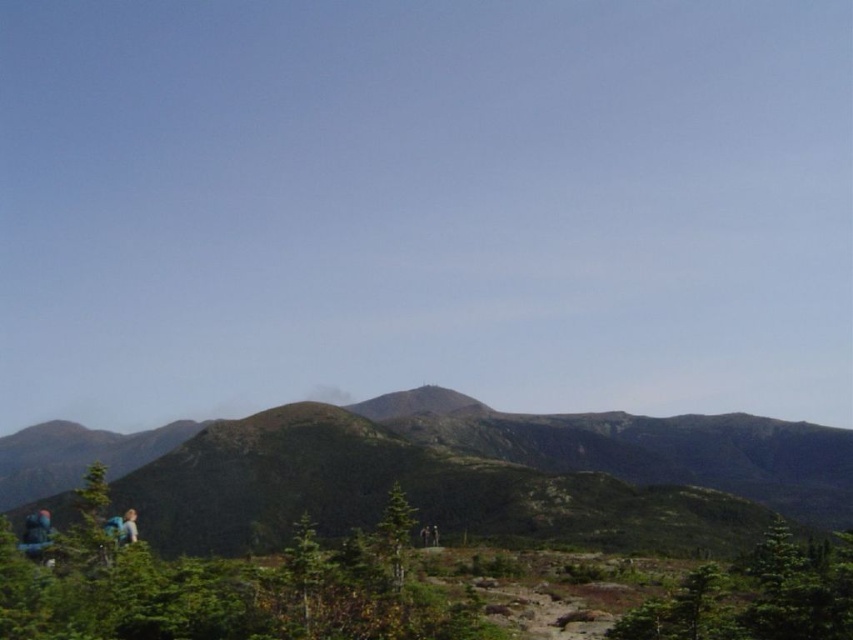
Does green grassy hill at center have a greater width compared to green grassy peak at center?

Yes.

Does green grassy hill at center appear under green grassy peak at center?

Indeed, green grassy hill at center is positioned under green grassy peak at center.

Where is `green grassy hill at center`? The image size is (853, 640). green grassy hill at center is located at coordinates (486, 474).